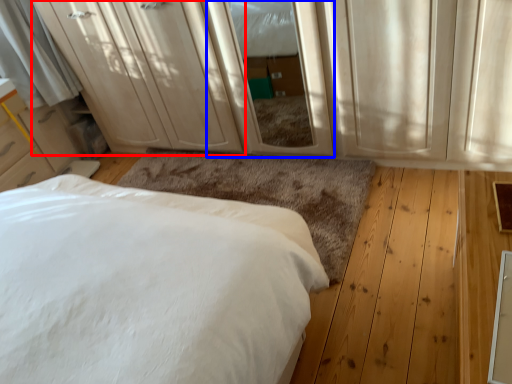
Question: Which of the following is the closest to the observer, dresser (highlighted by a red box) or screen door (highlighted by a blue box)?

Choices:
 (A) dresser
 (B) screen door

Answer: (B)